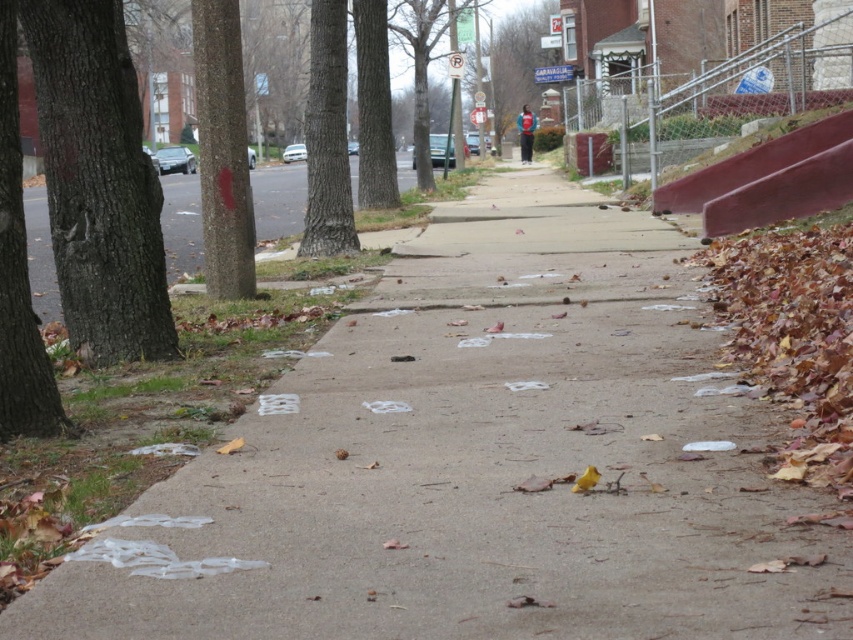
You are standing on the brown dirt sidewalk at left and want to reach the brown rough tree at left. Which direction should you move to get closer to the tree?

The brown rough tree at left is to the right of the brown dirt sidewalk at left, so you should move to your right to get closer to the tree.